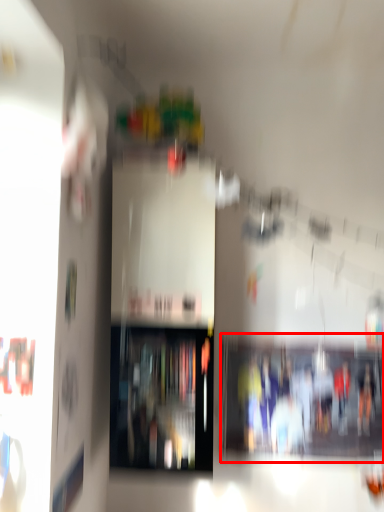
Question: In this image, where is shelf (annotated by the red box) located relative to shelf?

Choices:
 (A) left
 (B) right

Answer: (B)